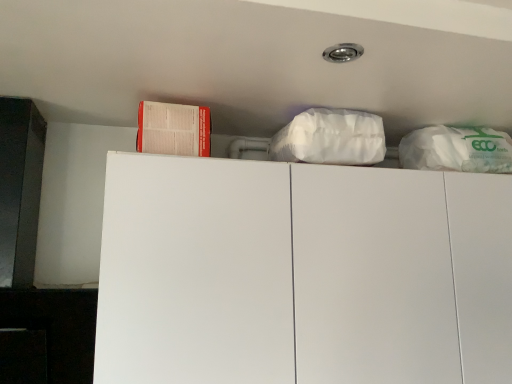
Locate an element on the screen. This screenshot has height=384, width=512. white matte cabinet at upper center is located at coordinates (302, 274).

From the picture: Measure the distance between white matte cabinet at upper center and camera.

The depth of white matte cabinet at upper center is 31.36 inches.

This screenshot has height=384, width=512. Describe the element at coordinates (302, 274) in the screenshot. I see `white matte cabinet at upper center` at that location.

This screenshot has width=512, height=384. What do you see at coordinates (173, 129) in the screenshot?
I see `red paper book at upper left` at bounding box center [173, 129].

In order to face red paper book at upper left, should I rotate leftwards or rightwards?

You should rotate left by 11.085 degrees.

Consider the image. Measure the distance between red paper book at upper left and camera.

red paper book at upper left is 36.69 inches away from camera.

You are a GUI agent. You are given a task and a screenshot of the screen. Output one action in this format:
    pyautogui.click(x=<x>, y=<y>)
    Task: Click on the red paper book at upper left
    This screenshot has height=384, width=512.
    Given the screenshot: What is the action you would take?
    pyautogui.click(x=173, y=129)

Image resolution: width=512 pixels, height=384 pixels. Find the location of `white matte cabinet at upper center`. white matte cabinet at upper center is located at coordinates (302, 274).

Is white matte cabinet at upper center at the left side of red paper book at upper left?

No, white matte cabinet at upper center is not to the left of red paper book at upper left.

Considering the relative positions of white matte cabinet at upper center and red paper book at upper left in the image provided, is white matte cabinet at upper center in front of red paper book at upper left?

Yes, white matte cabinet at upper center is closer to the viewer.

Which is less distant, (111, 185) or (192, 109)?

Point (111, 185) is positioned closer to the camera compared to point (192, 109).

In the scene shown: From the image's perspective, which object appears higher, white matte cabinet at upper center or red paper book at upper left?

red paper book at upper left.

From a real-world perspective, does white matte cabinet at upper center sit lower than red paper book at upper left?

Yes, from a real-world perspective, white matte cabinet at upper center is under red paper book at upper left.

Considering the relative sizes of white matte cabinet at upper center and red paper book at upper left in the image provided, is white matte cabinet at upper center thinner than red paper book at upper left?

In fact, white matte cabinet at upper center might be wider than red paper book at upper left.

Between white matte cabinet at upper center and red paper book at upper left, which one has less height?

With less height is red paper book at upper left.

From the picture: Who is smaller, white matte cabinet at upper center or red paper book at upper left?

Smaller between the two is red paper book at upper left.

Could red paper book at upper left be considered to be inside white matte cabinet at upper center?

No, red paper book at upper left is located outside of white matte cabinet at upper center.

Is white matte cabinet at upper center not close to red paper book at upper left?

No, white matte cabinet at upper center is in close proximity to red paper book at upper left.

Is white matte cabinet at upper center facing away from red paper book at upper left?

No, white matte cabinet at upper center is not facing away from red paper book at upper left.

How many degrees apart are the facing directions of white matte cabinet at upper center and red paper book at upper left?

There is a 1.74-degree angle between the facing directions of white matte cabinet at upper center and red paper book at upper left.

How distant is white matte cabinet at upper center from red paper book at upper left?

They are 14.81 inches apart.

The height and width of the screenshot is (384, 512). What are the coordinates of `cabinetry that appears below the red paper book at upper left (from the image's perspective)` in the screenshot? It's located at (x=302, y=274).

Does red paper book at upper left appear on the left side of white matte cabinet at upper center?

Yes.

Is red paper book at upper left in front of or behind white matte cabinet at upper center in the image?

Visually, red paper book at upper left is located behind white matte cabinet at upper center.

Considering the positions of point (191, 109) and point (479, 300), is point (191, 109) closer or farther from the camera than point (479, 300)?

Point (191, 109) is closer to the camera than point (479, 300).

From the image's perspective, who appears lower, red paper book at upper left or white matte cabinet at upper center?

white matte cabinet at upper center.

From a real-world perspective, does red paper book at upper left stand above white matte cabinet at upper center?

Yes, from a real-world perspective, red paper book at upper left is on top of white matte cabinet at upper center.

Does red paper book at upper left have a greater width compared to white matte cabinet at upper center?

In fact, red paper book at upper left might be narrower than white matte cabinet at upper center.

Is red paper book at upper left taller than white matte cabinet at upper center?

No.

Consider the image. Between red paper book at upper left and white matte cabinet at upper center, which one has larger size?

With larger size is white matte cabinet at upper center.

Is red paper book at upper left outside of white matte cabinet at upper center?

Yes, red paper book at upper left is not within white matte cabinet at upper center.

Is red paper book at upper left beside white matte cabinet at upper center?

No, red paper book at upper left is not touching white matte cabinet at upper center.

Is red paper book at upper left looking in the opposite direction of white matte cabinet at upper center?

No, red paper book at upper left's orientation is not away from white matte cabinet at upper center.

Locate an element on the screen. book above the white matte cabinet at upper center (from the image's perspective) is located at coordinates (173, 129).

I want to click on cabinetry below the red paper book at upper left (from the image's perspective), so click(302, 274).

This screenshot has height=384, width=512. In order to click on book behind the white matte cabinet at upper center in this screenshot , I will do `click(173, 129)`.